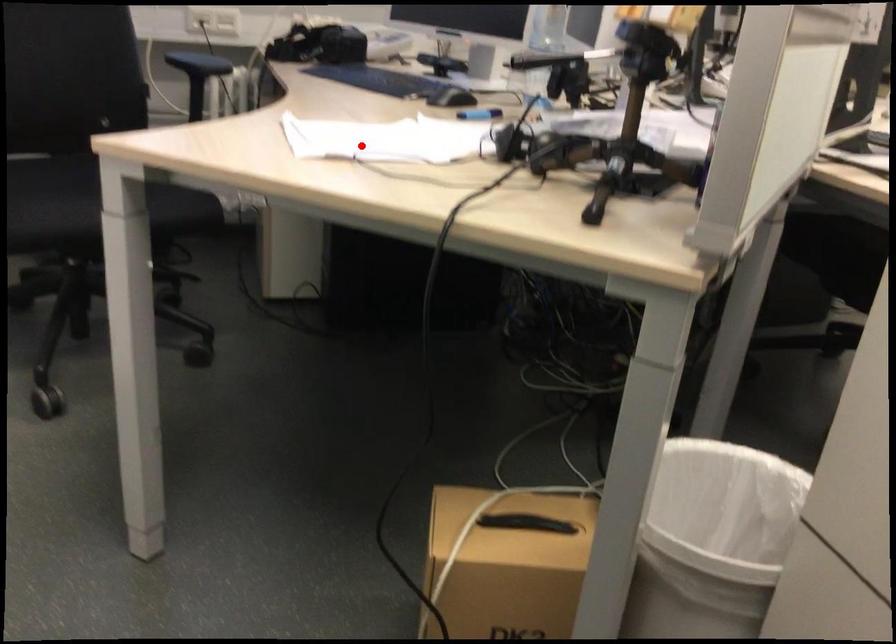
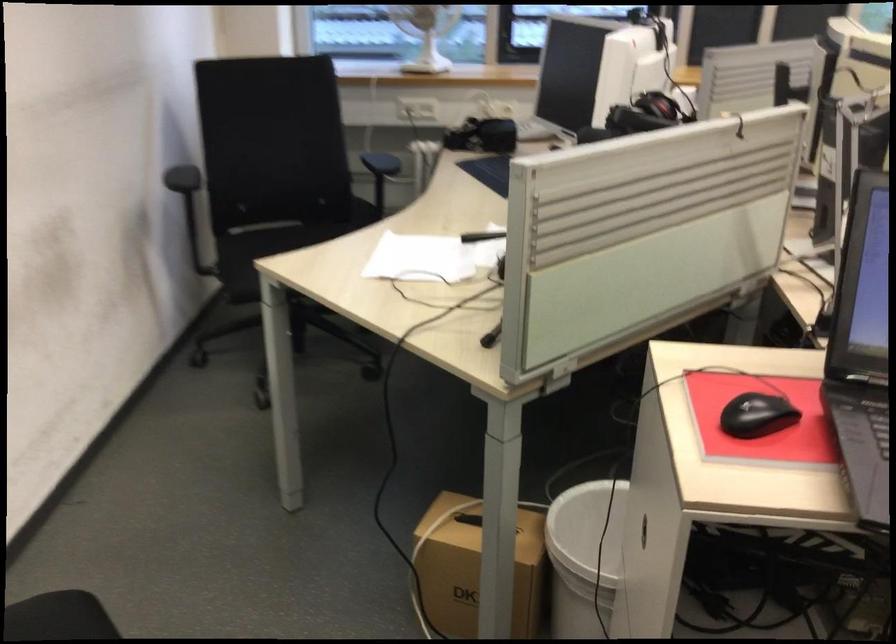
Question: I am providing you with two images of the same scene from different viewpoints. A red point is shown in image1. For the corresponding object point in image2, is it positioned nearer or farther from the camera?

Choices:
 (A) Nearer
 (B) Farther

Answer: (B)